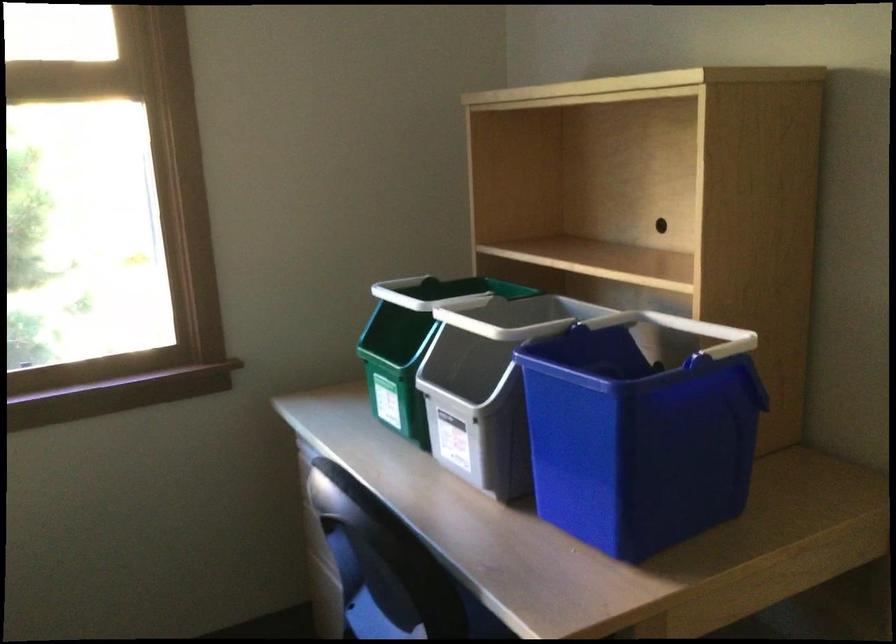
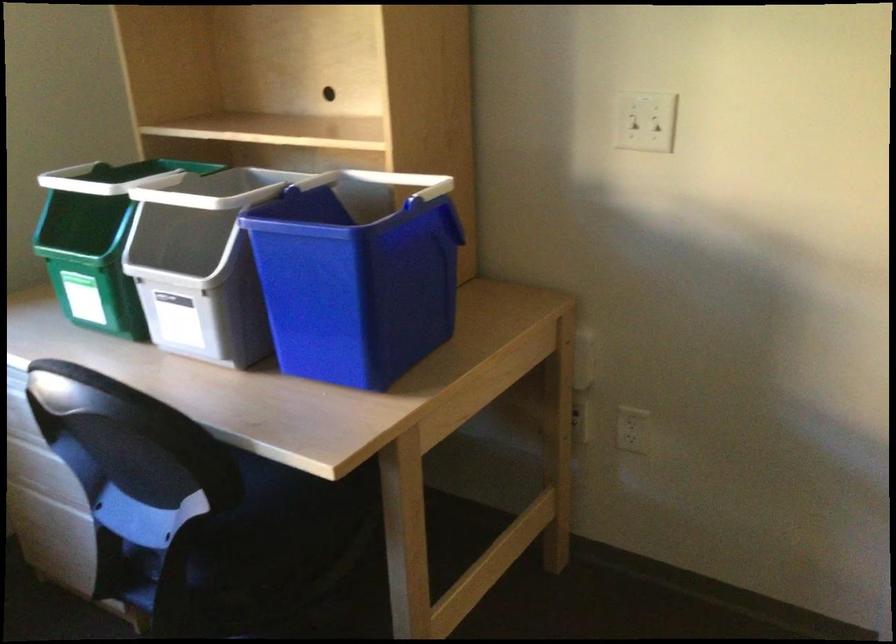
Question: The images are taken continuously from a first-person perspective. In which direction are you moving?

Choices:
 (A) Left
 (B) Right
 (C) Forward
 (D) Backward

Answer: (A)